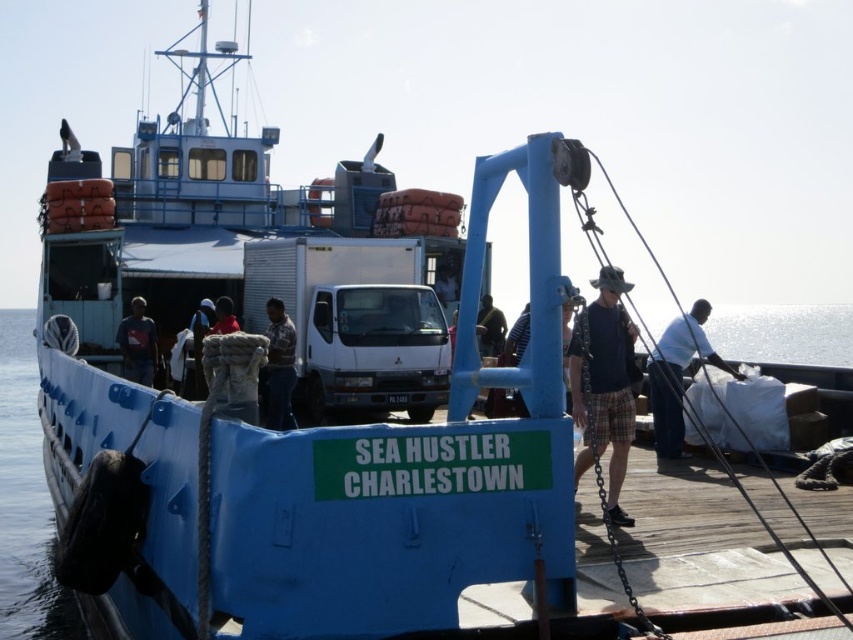
In the scene shown: You are a passenger on the ferry and want to pack your belongings into a storage compartment. You have a white fabric bag at right and a green fabric shirt at center. Which item can fit better into a small storage space?

The white fabric bag at right is smaller than the green fabric shirt at center, so it can fit better into a small storage space.

You are a passenger on the ferry and need to place a rectangular box that is 1 meter wide between the dark blue jeans at left and the green fabric shirt at center. Can the space between them accommodate the box?

The dark blue jeans at left is wider than the green fabric shirt at center. However, the total space between them isn there description of the distance between them, only their widths. So we cannot determine if the 1 meter wide box can fit based on the given information.

You are a passenger on the ferry and want to put on a jacket. You see a green fabric shirt at center and a light brown leather jacket at center. Which item is closer to your upper body when both are hanging on a hook?

The light brown leather jacket at center is closer to your upper body because it is positioned over the green fabric shirt at center.